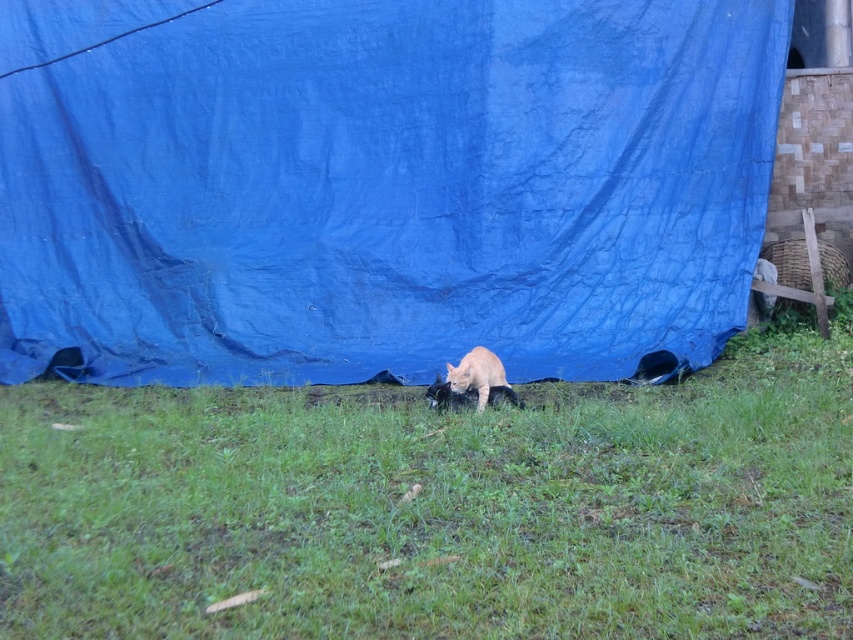
Question: Which is nearer to the blue tarpaulin at center?

Choices:
 (A) orange fur cat at center
 (B) green grass at center

Answer: (A)

Question: Which of these objects is positioned closest to the green grass at center?

Choices:
 (A) orange fur cat at center
 (B) blue tarpaulin at center

Answer: (A)

Question: Among these points, which one is farthest from the camera?

Choices:
 (A) (498, 369)
 (B) (392, 342)

Answer: (B)

Question: From the image, what is the correct spatial relationship of blue tarpaulin at center in relation to green grass at center?

Choices:
 (A) left
 (B) right

Answer: (A)

Question: Is green grass at center below orange fur cat at center?

Choices:
 (A) yes
 (B) no

Answer: (A)

Question: Does blue tarpaulin at center have a lesser width compared to green grass at center?

Choices:
 (A) no
 (B) yes

Answer: (B)